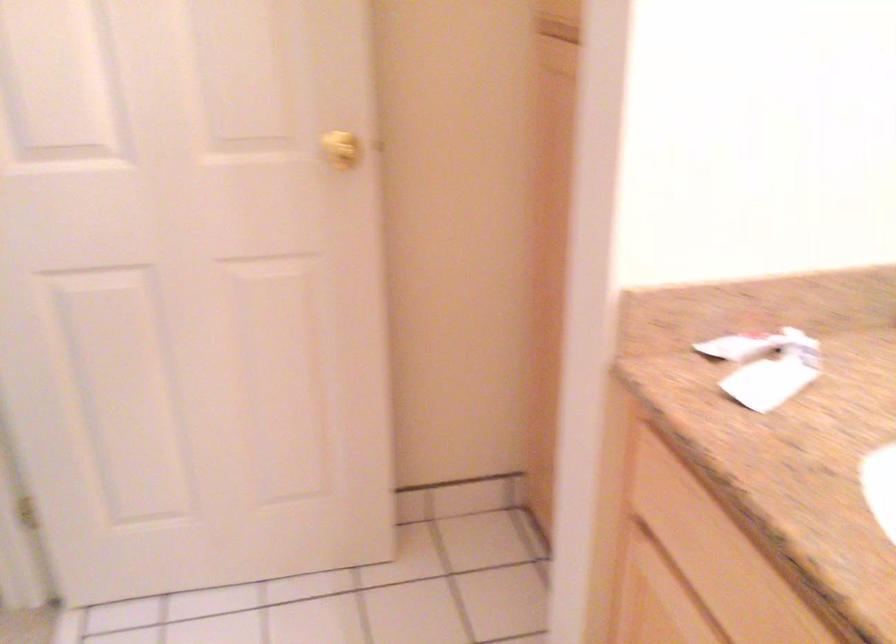
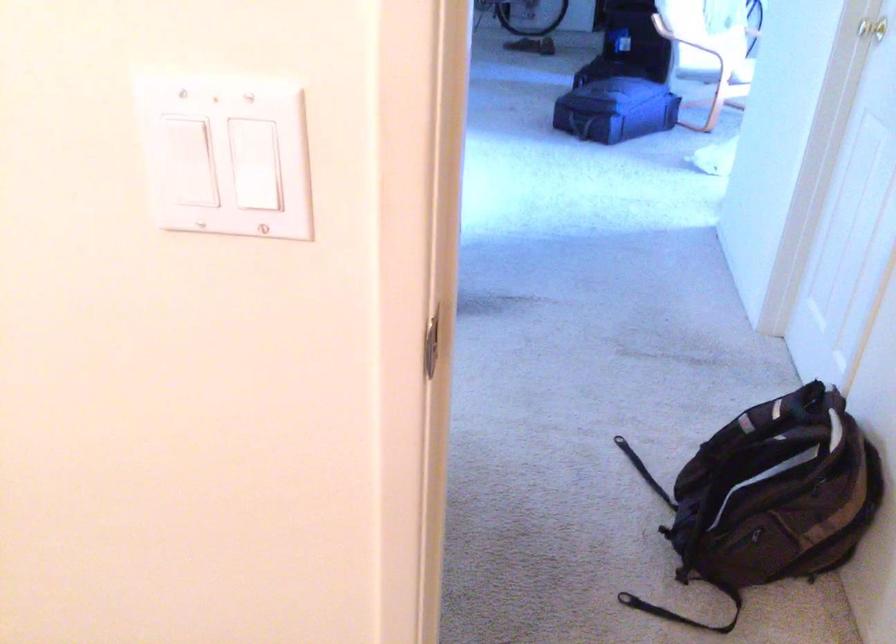
First-person continuous shooting, in which direction is the camera rotating?

The camera rotated toward left-down.